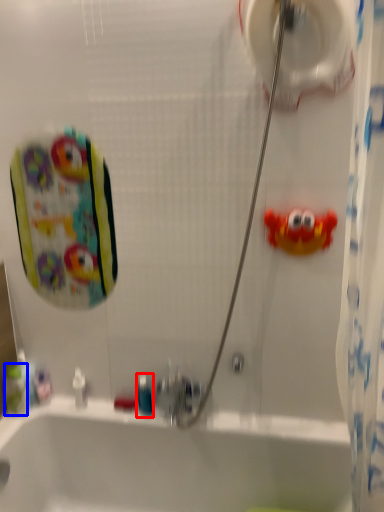
Question: Which object appears closest to the camera in this image, mouthwash (highlighted by a red box) or mouthwash (highlighted by a blue box)?

Choices:
 (A) mouthwash
 (B) mouthwash

Answer: (B)